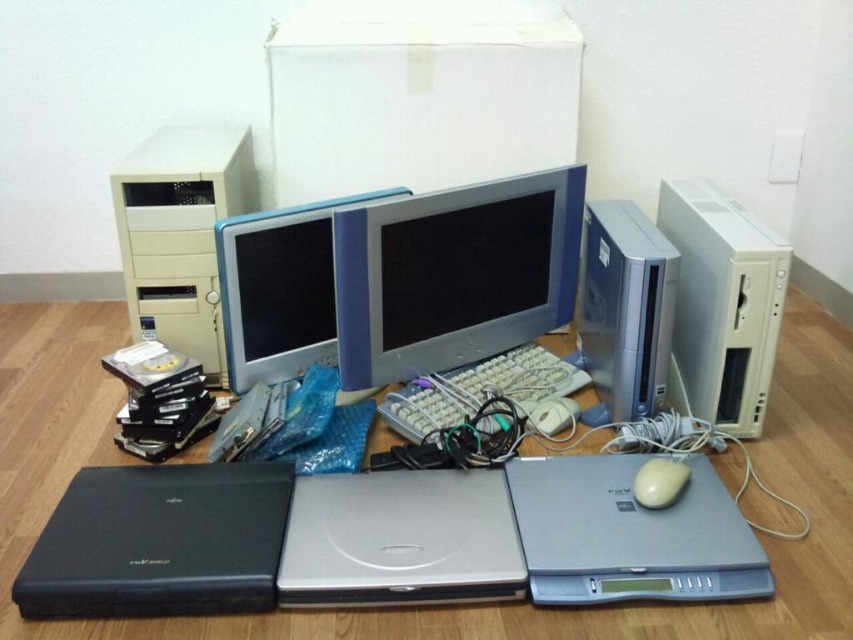
Which is behind, point (97, 588) or point (309, 236)?

Positioned behind is point (309, 236).

The image size is (853, 640). Identify the location of black matte laptop at lower left. (160, 541).

Is point (351, 541) more distant than point (273, 326)?

No, it is not.

Which is more to the left, silver metallic laptop at center or matte plastic monitor at center?

Positioned to the left is matte plastic monitor at center.

The width and height of the screenshot is (853, 640). What do you see at coordinates (399, 540) in the screenshot? I see `silver metallic laptop at center` at bounding box center [399, 540].

At what (x,y) coordinates should I click in order to perform the action: click on silver metallic laptop at center. Please return your answer as a coordinate pair (x, y). The height and width of the screenshot is (640, 853). Looking at the image, I should click on (399, 540).

Is satin silver laptop at lower center positioned behind white plastic desktop computer at right?

No, satin silver laptop at lower center is in front of white plastic desktop computer at right.

Is satin silver laptop at lower center below white plastic desktop computer at right?

Yes.

At what (x,y) coordinates should I click in order to perform the action: click on satin silver laptop at lower center. Please return your answer as a coordinate pair (x, y). Looking at the image, I should click on (630, 534).